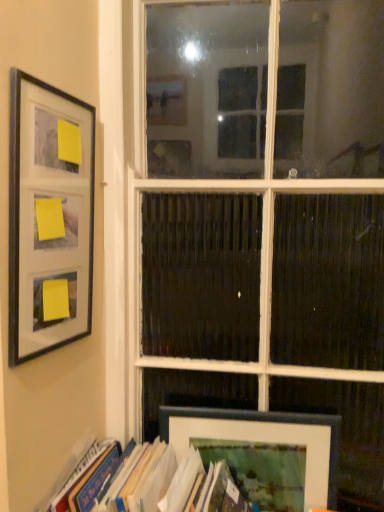
Question: Does matte black frame at left, marked as the second picture frame in a right-to-left arrangement, appear on the left side of hardcover book at lower left?

Choices:
 (A) yes
 (B) no

Answer: (A)

Question: Is matte black frame at left, the second picture frame positioned from the back, positioned far away from hardcover book at lower left?

Choices:
 (A) no
 (B) yes

Answer: (A)

Question: Is matte black frame at left, the 2th picture frame ordered from the bottom, smaller than hardcover book at lower left?

Choices:
 (A) yes
 (B) no

Answer: (A)

Question: Is matte black frame at left, placed as the first picture frame when sorted from front to back, facing away from hardcover book at lower left?

Choices:
 (A) yes
 (B) no

Answer: (B)

Question: Is matte black frame at left, placed as the first picture frame when sorted from front to back, shorter than hardcover book at lower left?

Choices:
 (A) no
 (B) yes

Answer: (A)

Question: In the image, is hardcover book at lower left on the left side or the right side of matte black frame at lower right, marked as the second picture frame in a left-to-right arrangement?

Choices:
 (A) right
 (B) left

Answer: (B)

Question: In terms of height, does hardcover book at lower left look taller or shorter compared to matte black frame at lower right, arranged as the 1th picture frame when ordered from the bottom?

Choices:
 (A) tall
 (B) short

Answer: (B)

Question: Looking at the image, does hardcover book at lower left seem bigger or smaller compared to matte black frame at lower right, which is counted as the second picture frame, starting from the top?

Choices:
 (A) big
 (B) small

Answer: (A)

Question: From the image's perspective, relative to matte black frame at lower right, arranged as the 2th picture frame when viewed from the front, is hardcover book at lower left above or below?

Choices:
 (A) above
 (B) below

Answer: (B)

Question: Considering the positions of matte black frame at left, placed as the first picture frame when sorted from front to back, and matte black frame at lower right, which is counted as the second picture frame, starting from the top, in the image, is matte black frame at left, placed as the first picture frame when sorted from front to back, wider or thinner than matte black frame at lower right, which is counted as the second picture frame, starting from the top,?

Choices:
 (A) wide
 (B) thin

Answer: (A)

Question: From a real-world perspective, relative to matte black frame at lower right, arranged as the 2th picture frame when viewed from the front, is matte black frame at left, positioned as the first picture frame in top-to-bottom order, vertically above or below?

Choices:
 (A) below
 (B) above

Answer: (B)

Question: Looking at the image, does matte black frame at left, which appears as the 1th picture frame when viewed from the left, seem bigger or smaller compared to matte black frame at lower right, arranged as the 2th picture frame when viewed from the front?

Choices:
 (A) big
 (B) small

Answer: (A)

Question: Is matte black frame at left, the 2th picture frame ordered from the bottom, to the left or to the right of matte black frame at lower right, marked as the second picture frame in a left-to-right arrangement, in the image?

Choices:
 (A) left
 (B) right

Answer: (A)

Question: In terms of width, does white glass window at center look wider or thinner when compared to hardcover book at lower left?

Choices:
 (A) wide
 (B) thin

Answer: (B)

Question: Relative to hardcover book at lower left, is white glass window at center in front or behind?

Choices:
 (A) behind
 (B) front

Answer: (A)